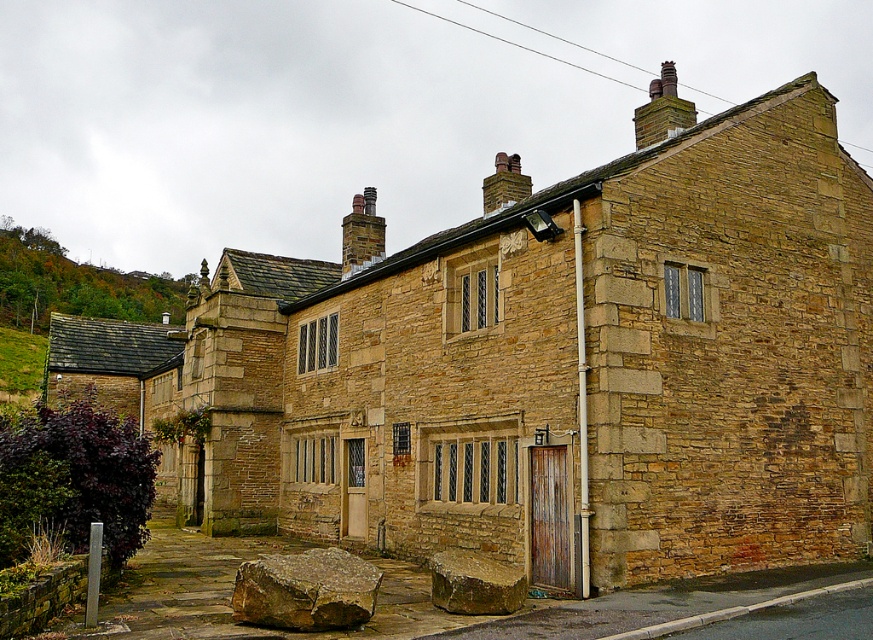
You are standing in front of the stone house and want to determine the relative positions of two points marked on the facade. Which point is closer to you, point 1 at coordinates (15, 225) or point 2 at coordinates (679, 113)?

Point 1 at coordinates (15, 225) is closer to you because it is further to the viewer than point 2 at coordinates (679, 113).

You are standing in front of the traditional stone house and notice the green leafy hillside at upper left and the dark gray stone chimney at upper center. Which of these two objects is closer to you?

The green leafy hillside at upper left is closer to you because it is further to the viewer than the dark gray stone chimney at upper center, meaning it appears nearer in the scene.